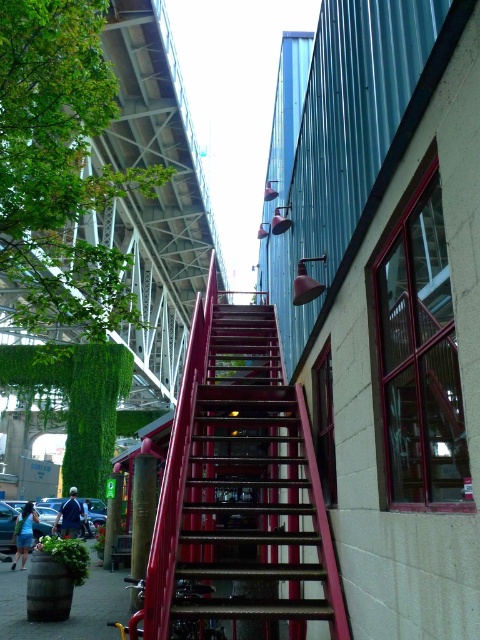
You are a delivery person with a cart that is 3 meters wide. You need to navigate between the metallic red staircase at center and the brown wooden barrel at lower left. Can your cart fit through the space between them?

The metallic red staircase at center and brown wooden barrel at lower left are 3.27 meters apart from each other. Since your cart is 3 meters wide, it can fit through the space between them as the distance is greater than the cart width.

You are standing at the lower left corner of the image and want to walk towards the building. Which object will you encounter first, the metallic red staircase at center or the brown wooden barrel at lower left?

You will encounter the brown wooden barrel at lower left first because it is located at your starting position. After that, you will reach the metallic red staircase at center which is to the right of the brown wooden barrel at lower left.